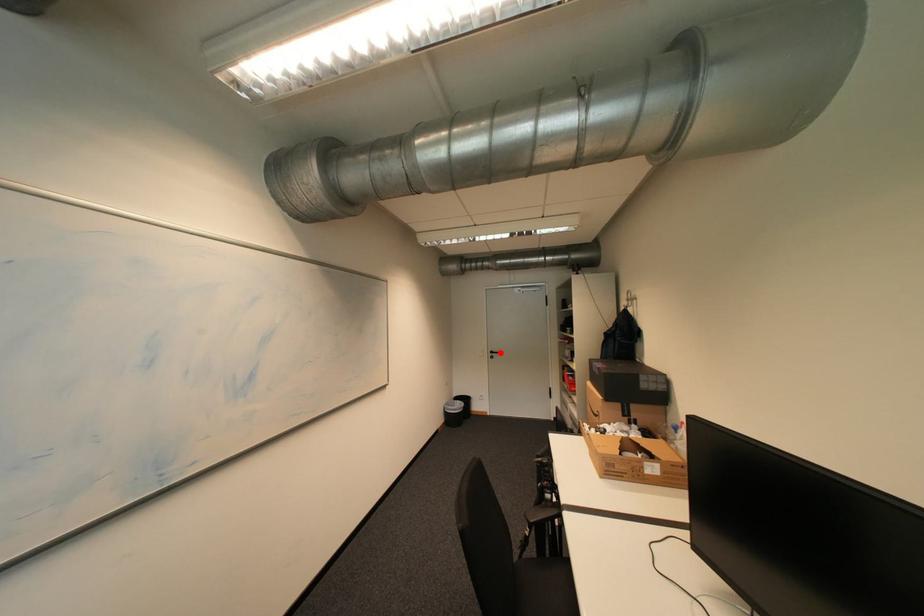
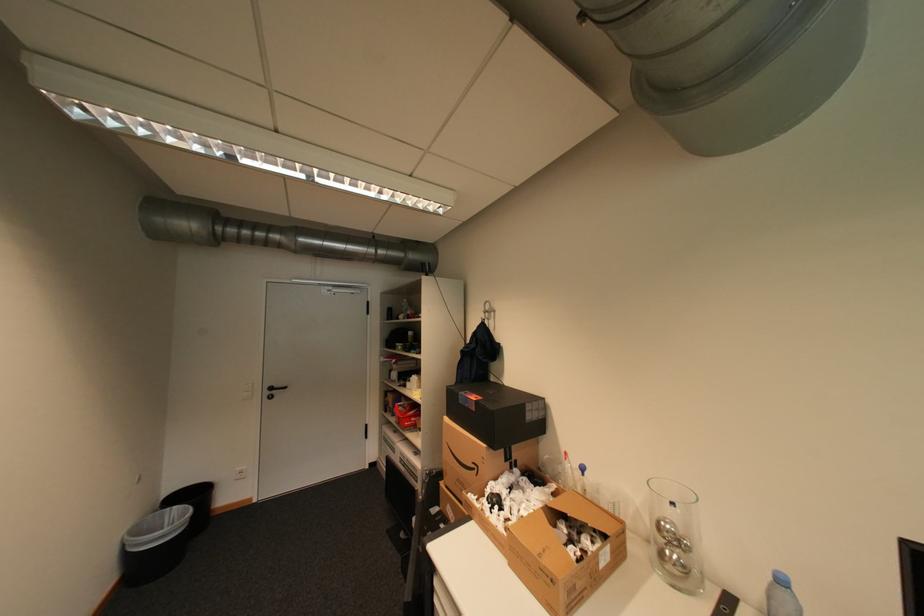
The point at the highlighted location is marked in the first image. Where is the corresponding point in the second image?

(280, 389)